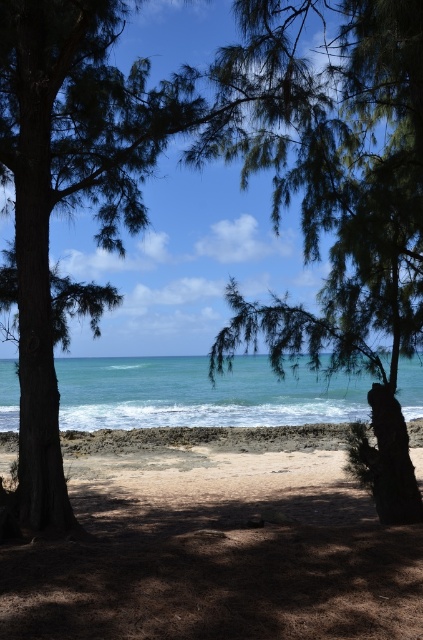
You are standing in the middle of a coastal path between two large trees. You see a green leafy tree at center and a blue water at center. Which object is nearer to you?

The green leafy tree at center is closer to the viewer than the blue water at center, so the green leafy tree at center is nearer to you.